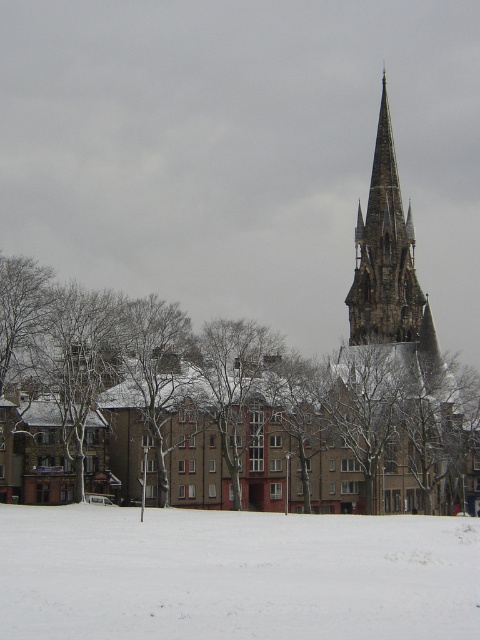
Which is above, snow-covered tree at lower left or dark gray stone spire at upper center?

dark gray stone spire at upper center is above.

Can you confirm if snow-covered tree at lower left is taller than dark gray stone spire at upper center?

No.

Who is more distant from viewer, (140,355) or (414,323)?

The point (414,323) is more distant.

Where is `snow-covered tree at lower left`? This screenshot has height=640, width=480. snow-covered tree at lower left is located at coordinates (288, 417).

Between white powdery snow at lower center and dark gray stone spire at upper center, which one is positioned lower?

white powdery snow at lower center is lower down.

Is white powdery snow at lower center further to camera compared to dark gray stone spire at upper center?

No.

Locate an element on the screen. white powdery snow at lower center is located at coordinates (235, 573).

Locate an element on the screen. The height and width of the screenshot is (640, 480). white powdery snow at lower center is located at coordinates coord(235,573).

This screenshot has width=480, height=640. What do you see at coordinates (288, 417) in the screenshot? I see `snow-covered tree at lower left` at bounding box center [288, 417].

Who is more forward, (403, 352) or (373, 600)?

Positioned in front is point (373, 600).

Who is more forward, (348, 454) or (432, 584)?

Point (432, 584) is more forward.

This screenshot has height=640, width=480. Find the location of `snow-covered tree at lower left`. snow-covered tree at lower left is located at coordinates (288, 417).